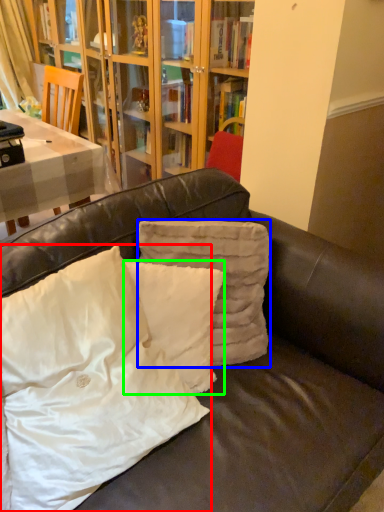
Question: Estimate the real-world distances between objects in this image. Which object is closer to pillow (highlighted by a red box), pillow (highlighted by a blue box) or pillow (highlighted by a green box)?

Choices:
 (A) pillow
 (B) pillow

Answer: (B)